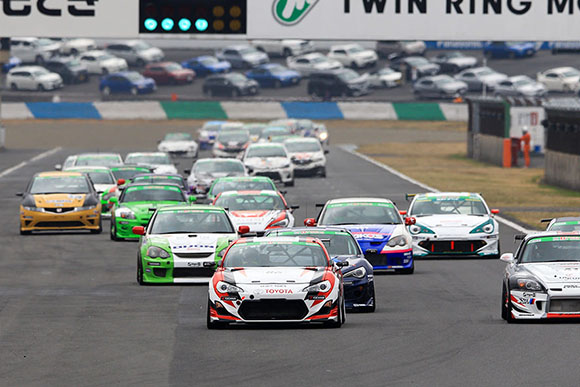
The height and width of the screenshot is (387, 580). What are the coordinates of `green light` in the screenshot? It's located at (151, 26), (169, 24), (186, 26), (201, 23).